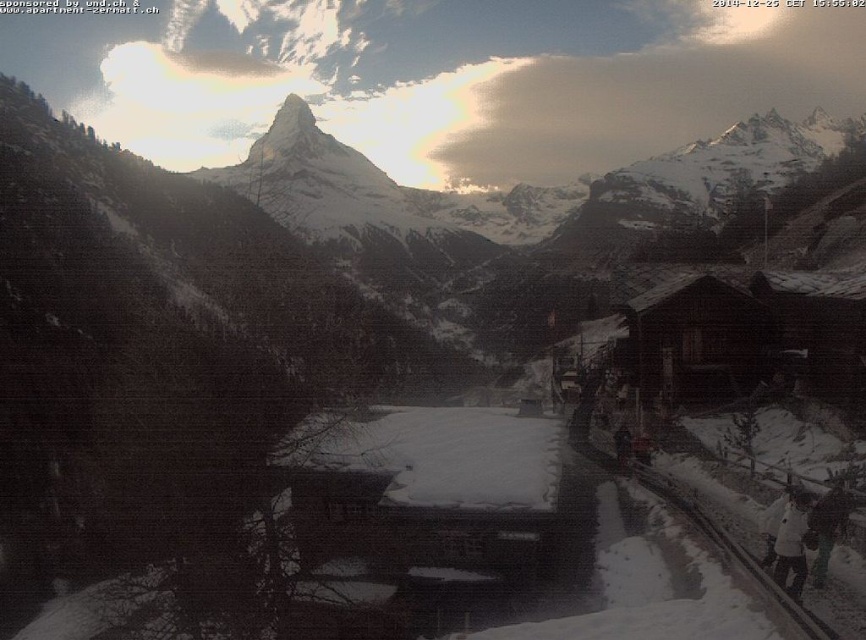
Is wooden cabin at right closer to camera compared to dark gray metal train track at lower right?

That is False.

Is point (650, 374) positioned before point (776, 584)?

That is False.

Does point (625, 333) lie in front of point (634, 465)?

No, it is not.

Identify the location of wooden cabin at right. (737, 340).

Who is positioned more to the right, wooden cabin at right or white snowboarder at lower right?

Positioned to the right is wooden cabin at right.

Who is more forward, (682, 384) or (790, 552)?

Point (790, 552)

The image size is (866, 640). I want to click on wooden cabin at right, so (x=737, y=340).

Measure the distance between point (674,500) and camera.

Point (674,500) is 63.80 meters from camera.

Between dark gray metal train track at lower right and white snowboarder at lower right, which one appears on the left side from the viewer's perspective?

From the viewer's perspective, dark gray metal train track at lower right appears more on the left side.

What do you see at coordinates (735, 556) in the screenshot? This screenshot has width=866, height=640. I see `dark gray metal train track at lower right` at bounding box center [735, 556].

Identify the location of dark gray metal train track at lower right. (735, 556).